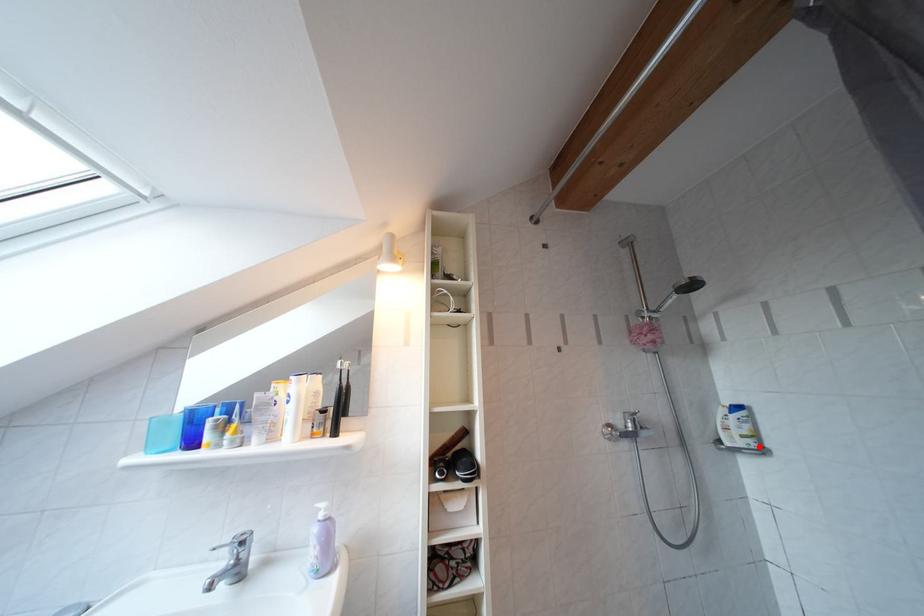
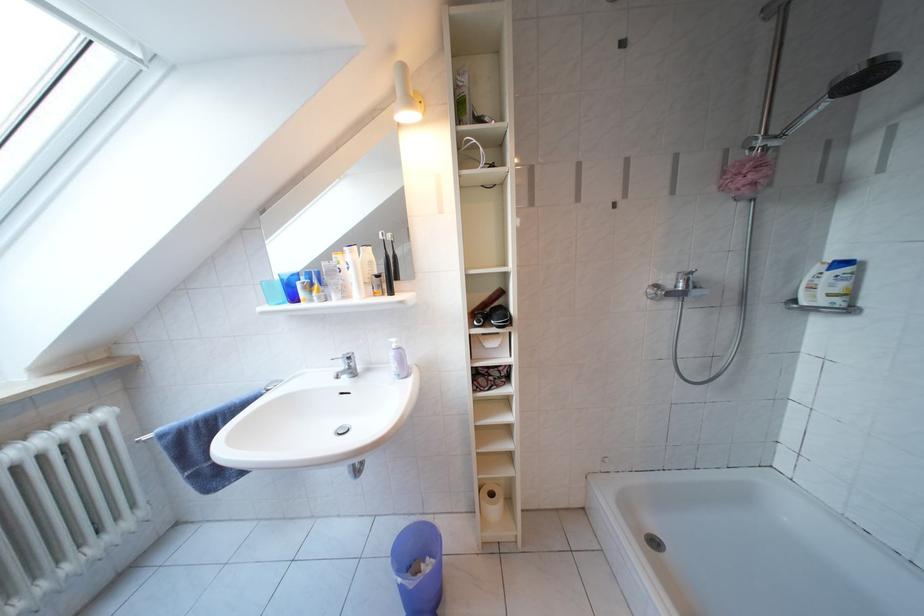
The point at the highlighted location is marked in the first image. Where is the corresponding point in the second image?

(846, 306)